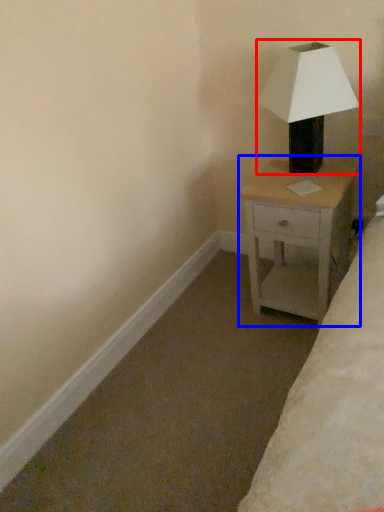
Question: Which object appears closest to the camera in this image, lamp (highlighted by a red box) or nightstand (highlighted by a blue box)?

Choices:
 (A) lamp
 (B) nightstand

Answer: (A)